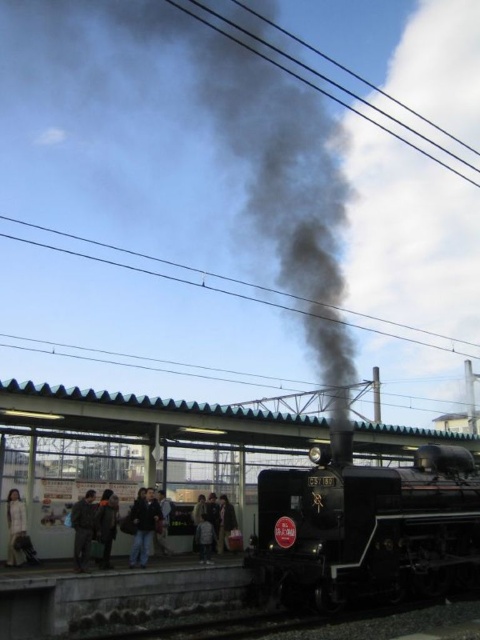
Question: Which of the following is the closest to the observer?

Choices:
 (A) pos(219,536)
 (B) pos(13,513)
 (C) pos(143,506)

Answer: (B)

Question: Among these objects, which one is nearest to the camera?

Choices:
 (A) light gray fabric jacket at center
 (B) dark blue jeans at center
 (C) white woolen coat at lower left
 (D) light beige jacket at center

Answer: (C)

Question: Considering the relative positions of black metal train at center and light gray fabric jacket at center in the image provided, where is black metal train at center located with respect to light gray fabric jacket at center?

Choices:
 (A) left
 (B) right

Answer: (B)

Question: Can you confirm if black metal train at center is thinner than light beige jacket at center?

Choices:
 (A) no
 (B) yes

Answer: (A)

Question: Is light beige jacket at center further to the viewer compared to light gray fabric jacket at center?

Choices:
 (A) yes
 (B) no

Answer: (A)

Question: Considering the real-world distances, which object is closest to the light gray fabric jacket at center?

Choices:
 (A) white woolen coat at lower left
 (B) black metal train at center
 (C) light beige jacket at center

Answer: (C)